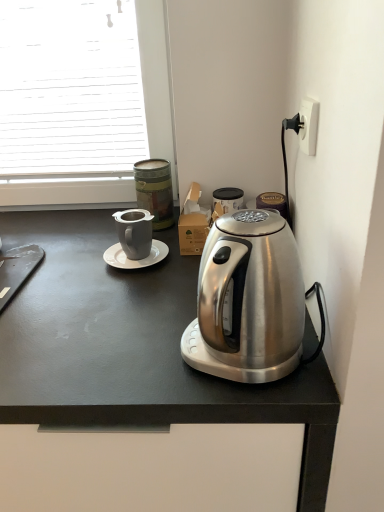
This screenshot has width=384, height=512. I want to click on free space in front of white glossy saucer at center, so click(123, 298).